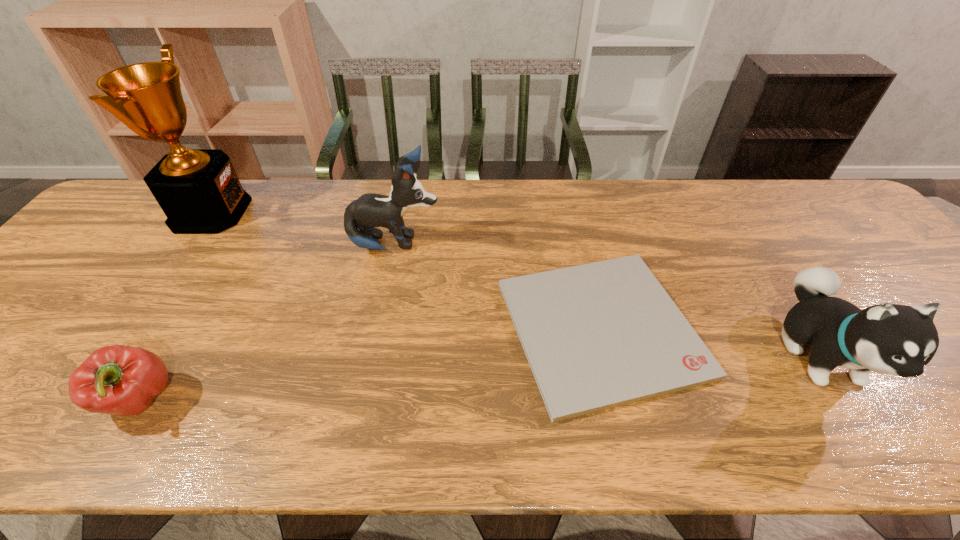
Locate which object is the fourth closest to the third shortest object. Please provide its 2D coordinates. Your answer should be formatted as a tuple, i.e. [(x, y)], where the tuple contains the x and y coordinates of a point satisfying the conditions above.

[(198, 190)]

Identify the location of free space that satisfies the following two spatial constraints: 1. on the front of the clipboard with the label; 2. on the left side of the trophy cup. (132, 328).

This screenshot has height=540, width=960. I want to click on free region that satisfies the following two spatial constraints: 1. on the front of the fourth object from left to right with the label; 2. on the left side of the tallest object, so click(x=132, y=328).

I want to click on free space in the image that satisfies the following two spatial constraints: 1. on the front of the fourth object from left to right with the label; 2. on the right side of the trophy cup, so click(x=132, y=328).

Where is `free region that satisfies the following two spatial constraints: 1. on the front of the fourth object from left to right with the label; 2. on the right side of the trophy cup`? This screenshot has height=540, width=960. free region that satisfies the following two spatial constraints: 1. on the front of the fourth object from left to right with the label; 2. on the right side of the trophy cup is located at coordinates (132, 328).

Find the location of `blank space that satisfies the following two spatial constraints: 1. on the front of the trophy cup with the label; 2. on the right side of the clipboard`. blank space that satisfies the following two spatial constraints: 1. on the front of the trophy cup with the label; 2. on the right side of the clipboard is located at coordinates (132, 328).

This screenshot has height=540, width=960. I want to click on vacant space that satisfies the following two spatial constraints: 1. on the front-facing side of the left puppy; 2. on the front side of the bell pepper, so click(x=365, y=399).

I want to click on free point that satisfies the following two spatial constraints: 1. on the front of the bell pepper with the label; 2. on the right side of the tallest object, so click(83, 399).

Locate an element on the screen. The height and width of the screenshot is (540, 960). free space that satisfies the following two spatial constraints: 1. on the front of the trophy cup with the label; 2. on the right side of the bell pepper is located at coordinates (83, 399).

In order to click on free location that satisfies the following two spatial constraints: 1. on the front of the shortest object with the label; 2. on the left side of the trophy cup in this screenshot , I will do `click(132, 328)`.